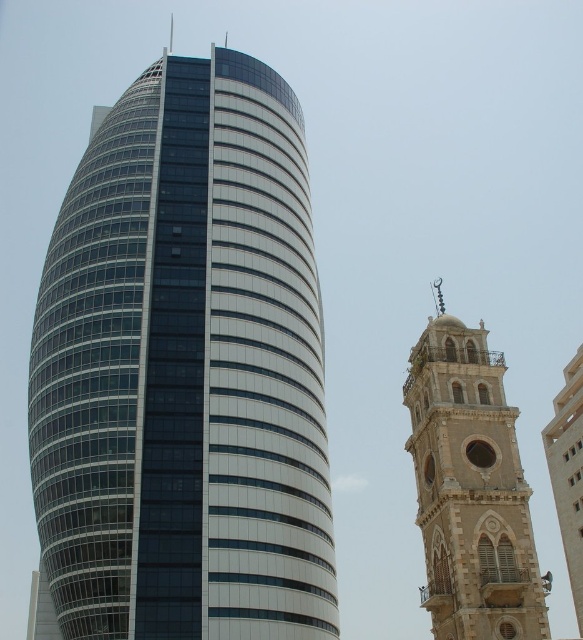
You are an architect analyzing the spatial layout of the scene. Given that the glassy steel tower at center is positioned at coordinates point 0.581, 0.316, can you determine if it is closer to the left or right edge of the image?

The glassy steel tower at center is located at point (184, 371). Since the x coordinate is 0.581, which is closer to 1.0 than 0.0, it is positioned closer to the right edge of the image.

You are an architect analyzing the spatial relationship between the glassy steel tower at center and the stone tower at right in the image. Which tower is located higher from the ground level?

The glassy steel tower at center is positioned over the stone tower at right, so it is higher from the ground level.